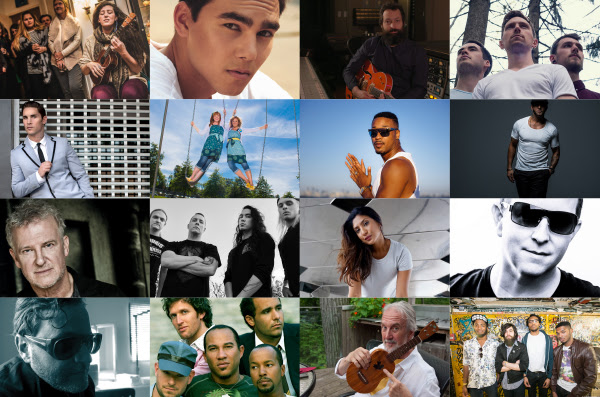
You are a GUI agent. You are given a task and a screenshot of the screen. Output one action in this format:
    pyautogui.click(x=<x>, y=<y>)
    Task: Click on the indoor photos
    Image resolution: width=600 pixels, height=397 pixels.
    Given the screenshot: What is the action you would take?
    pyautogui.click(x=75, y=346), pyautogui.click(x=123, y=256), pyautogui.click(x=417, y=225), pyautogui.click(x=402, y=63), pyautogui.click(x=94, y=69)